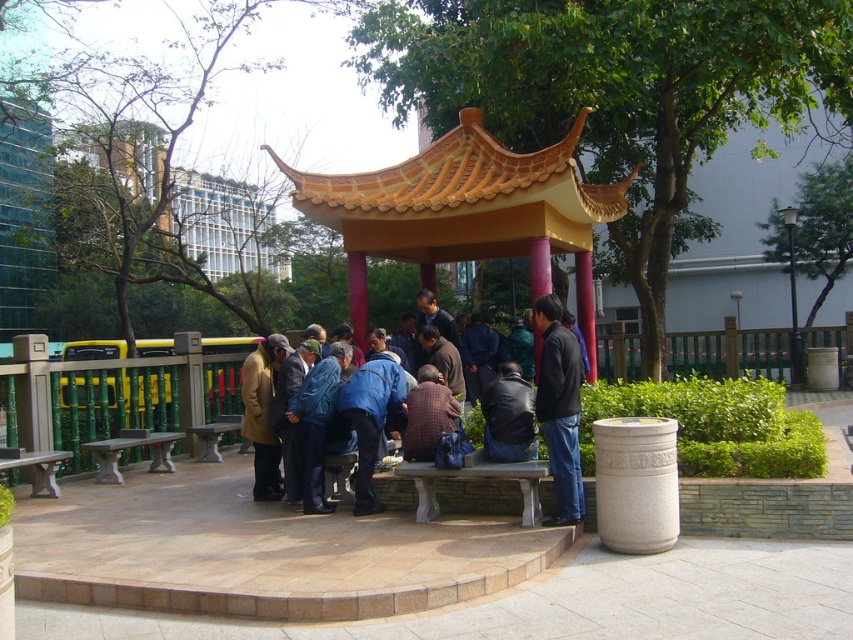
Question: Is dark gray jacket at center above blue fabric jacket at center?

Choices:
 (A) no
 (B) yes

Answer: (B)

Question: Estimate the real-world distances between objects in this image. Which object is closer to the dark gray jacket at center?

Choices:
 (A) blue fabric jacket at center
 (B) matte orange gazebo at center

Answer: (A)

Question: Is dark gray jacket at center smaller than blue fabric jacket at center?

Choices:
 (A) yes
 (B) no

Answer: (A)

Question: Is matte orange gazebo at center to the left of blue fabric jacket at center from the viewer's perspective?

Choices:
 (A) yes
 (B) no

Answer: (A)

Question: Which is farther from the dark gray jacket at center?

Choices:
 (A) matte orange gazebo at center
 (B) blue fabric jacket at center

Answer: (A)

Question: Which point appears farthest from the camera in this image?

Choices:
 (A) (561, 445)
 (B) (412, 420)
 (C) (386, 204)

Answer: (C)